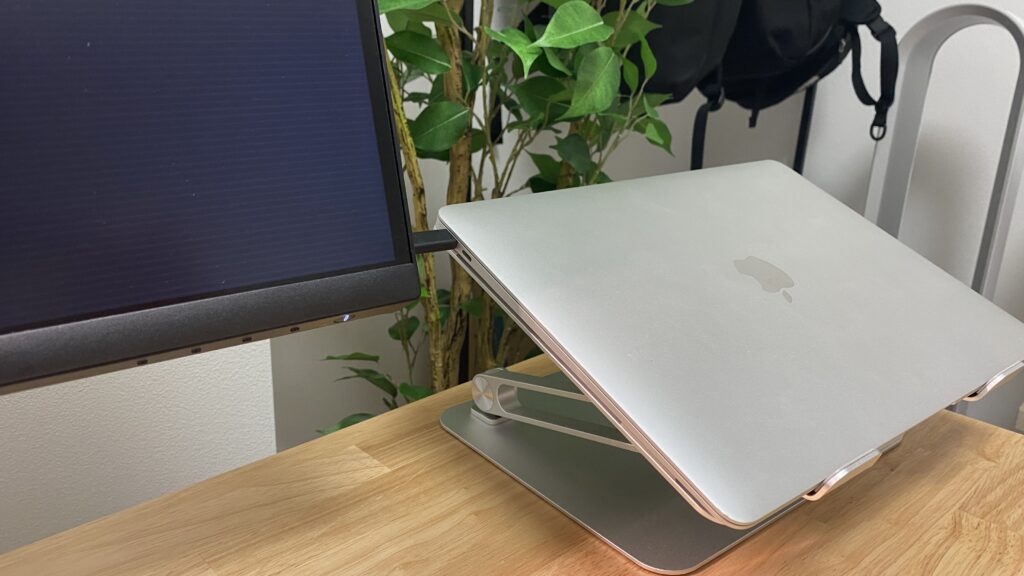
Identify the location of monitor frame. The image size is (1024, 576). (105, 341).